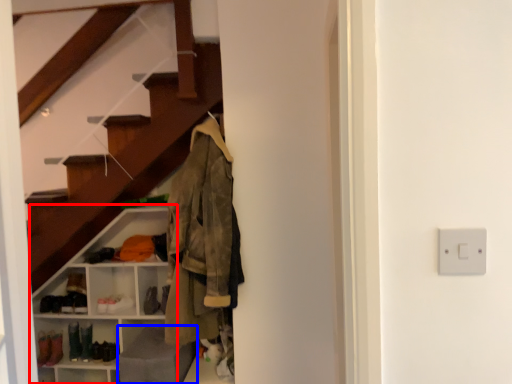
Question: Among these objects, which one is nearest to the camera, shelf (highlighted by a red box) or gray (highlighted by a blue box)?

Choices:
 (A) shelf
 (B) gray

Answer: (B)